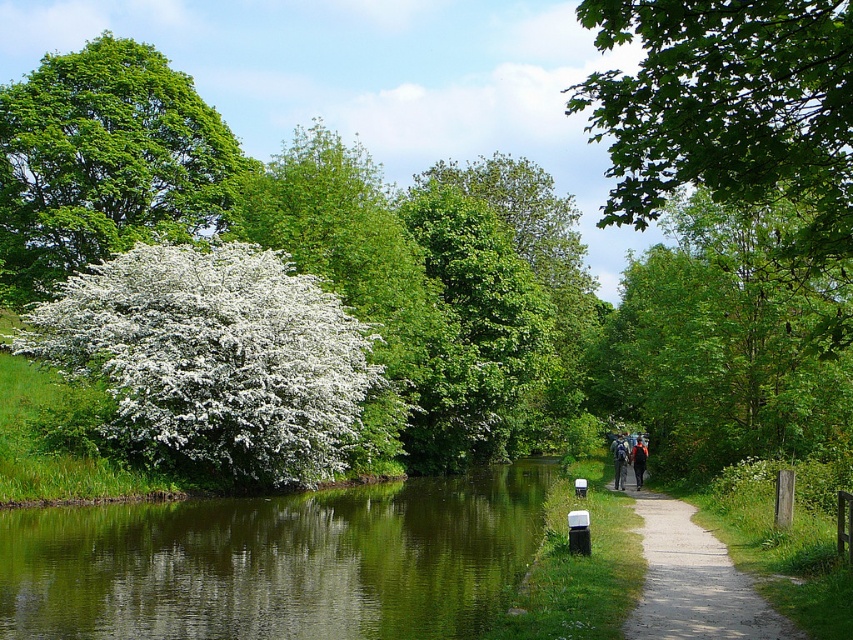
Question: Which of these objects is positioned closest to the green leafy tree at upper right?

Choices:
 (A) green reflective water at center
 (B) white fluffy bush at left
 (C) dark blue backpack at center-right
 (D) green leafy tree at upper left

Answer: (B)

Question: Is green leafy tree at upper left in front of dark blue backpack at center-right?

Choices:
 (A) no
 (B) yes

Answer: (A)

Question: Is the position of green fabric backpack at center-right less distant than that of dark blue backpack at center-right?

Choices:
 (A) no
 (B) yes

Answer: (B)

Question: Does green leafy tree at upper left have a greater width compared to green fabric backpack at center-right?

Choices:
 (A) no
 (B) yes

Answer: (B)

Question: Which of the following is the farthest from the observer?

Choices:
 (A) (70, 332)
 (B) (633, 468)
 (C) (782, 632)

Answer: (B)

Question: Among these objects, which one is farthest from the camera?

Choices:
 (A) green leafy tree at upper left
 (B) green leafy tree at upper right
 (C) green fabric backpack at center-right
 (D) dirt/gravel path at center-right

Answer: (A)